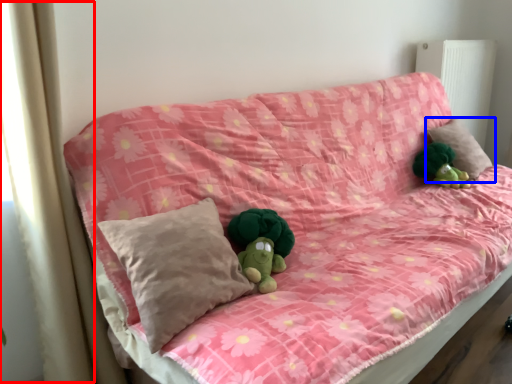
Question: Which point is further to the camera, curtain (highlighted by a red box) or pillow (highlighted by a blue box)?

Choices:
 (A) curtain
 (B) pillow

Answer: (B)